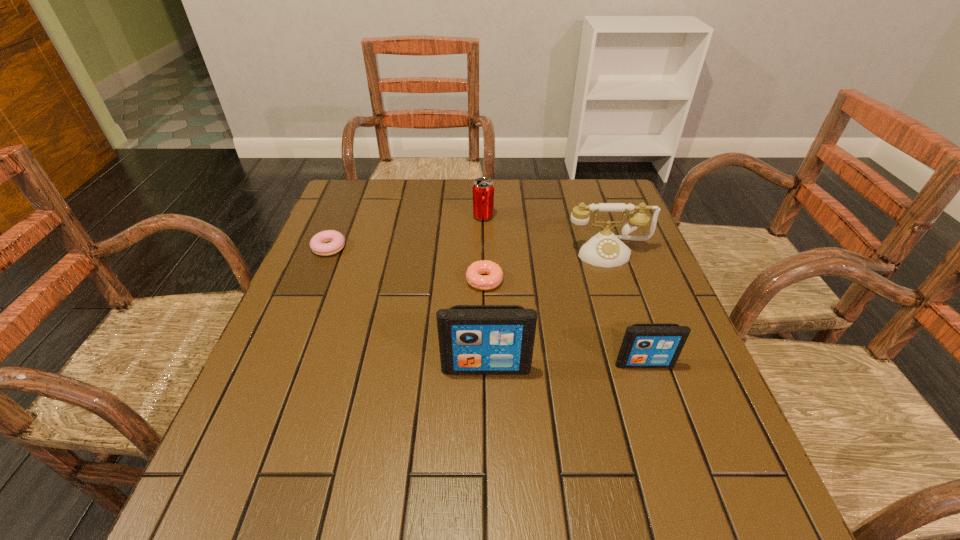
Identify the location of free space for a new iPod on the left. (325, 372).